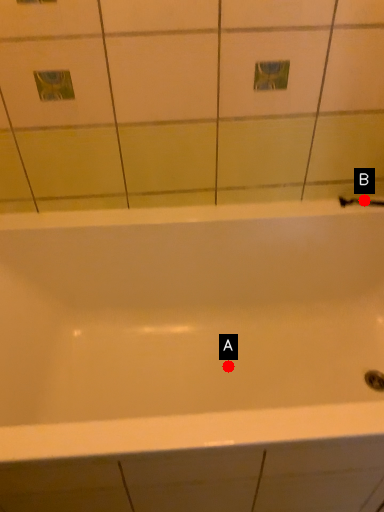
Question: Two points are circled on the image, labeled by A and B beside each circle. Which of the following is the closest to the observer?

Choices:
 (A) A is closer
 (B) B is closer

Answer: (B)